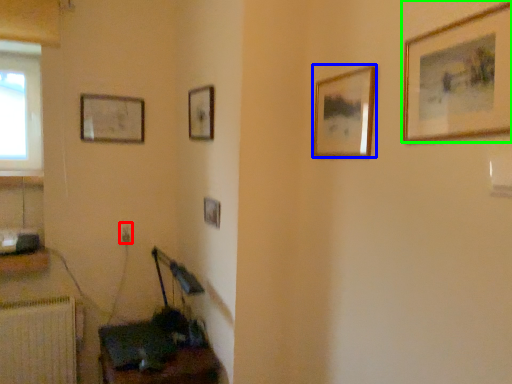
Question: Based on their relative distances, which object is nearer to electric outlet (highlighted by a red box)? Choose from picture frame (highlighted by a blue box) and picture frame (highlighted by a green box).

Choices:
 (A) picture frame
 (B) picture frame

Answer: (A)